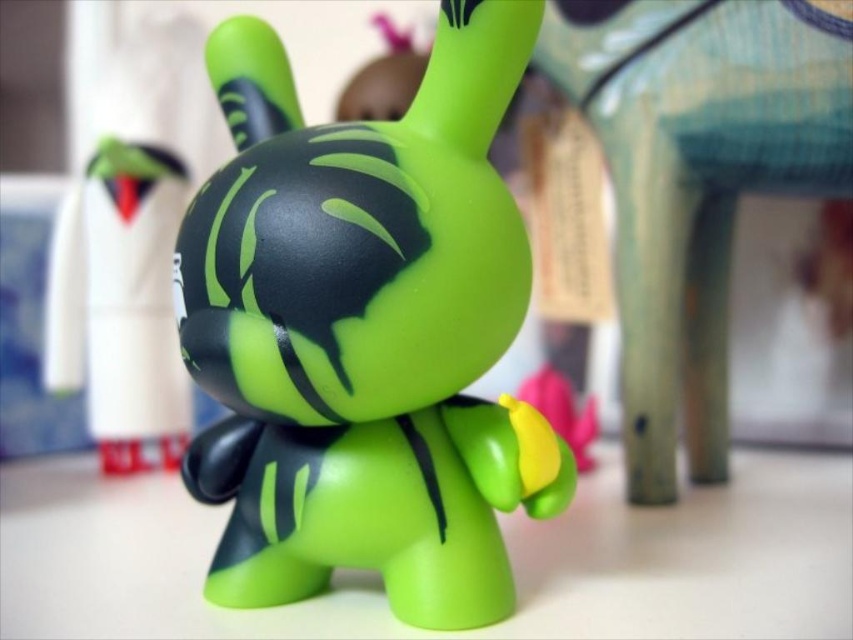
Question: Is green matte table at center to the left of green matte toy at upper left from the viewer's perspective?

Choices:
 (A) yes
 (B) no

Answer: (B)

Question: Where is matte green plastic toy at center located in relation to green matte toy at upper left in the image?

Choices:
 (A) left
 (B) right

Answer: (B)

Question: Which of these objects is positioned closest to the green matte table at center?

Choices:
 (A) green matte toy at center
 (B) matte green plastic toy at center
 (C) green matte toy at upper left

Answer: (B)

Question: Among these objects, which one is nearest to the camera?

Choices:
 (A) green matte table at center
 (B) green matte toy at upper left
 (C) green matte toy at center

Answer: (A)

Question: Is matte green plastic toy at center smaller than green matte table at center?

Choices:
 (A) no
 (B) yes

Answer: (B)

Question: Which object appears farthest from the camera in this image?

Choices:
 (A) green matte toy at center
 (B) matte green plastic toy at center

Answer: (A)